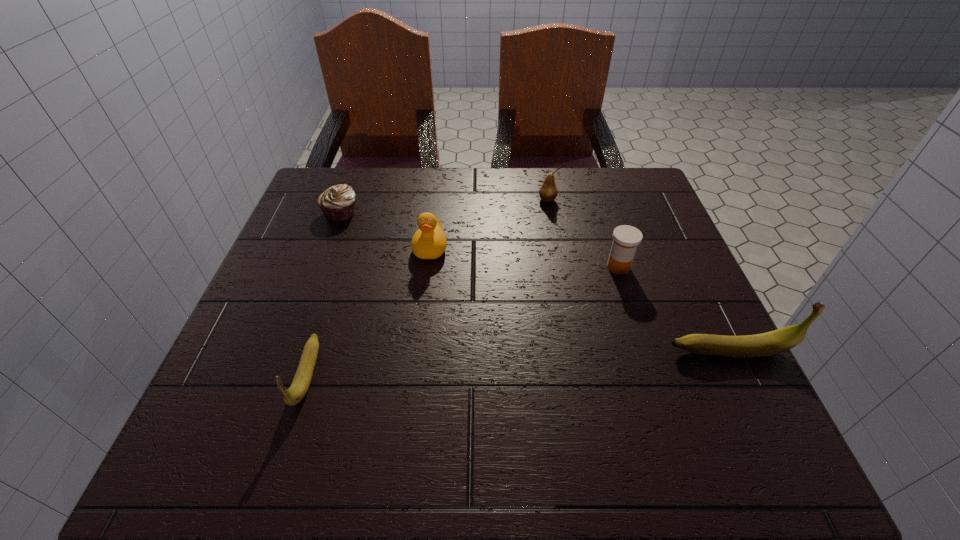
The image size is (960, 540). I want to click on vacant space that is in between the fourth object from left to right and the shorter banana, so coord(427,287).

Find the location of a particular element. vacant point located between the shorter banana and the shortest object is located at coordinates (324, 294).

This screenshot has height=540, width=960. Find the location of `vacant space that's between the medicine and the shorter banana`. vacant space that's between the medicine and the shorter banana is located at coordinates (463, 321).

The height and width of the screenshot is (540, 960). Identify the location of empty location between the muffin and the shorter banana. (324, 294).

The width and height of the screenshot is (960, 540). What are the coordinates of `free space between the taller banana and the medicine` in the screenshot? It's located at (674, 309).

Find the location of a particular element. This screenshot has width=960, height=540. free spot between the muffin and the right banana is located at coordinates (535, 282).

At what (x,y) coordinates should I click in order to perform the action: click on empty space that is in between the pear and the medicine. Please return your answer as a coordinate pair (x, y). This screenshot has width=960, height=540. Looking at the image, I should click on (583, 233).

Find the location of a particular element. This screenshot has height=540, width=960. vacant space in between the duck and the rightmost object is located at coordinates (580, 299).

You are a GUI agent. You are given a task and a screenshot of the screen. Output one action in this format:
    pyautogui.click(x=<x>, y=<y>)
    Task: Click on the object that is the fifth closest to the right banana
    
    Given the screenshot: What is the action you would take?
    pyautogui.click(x=337, y=203)

Identify which object is the closest to the right banana. Please provide its 2D coordinates. Your answer should be formatted as a tuple, i.e. [(x, y)], where the tuple contains the x and y coordinates of a point satisfying the conditions above.

[(626, 238)]